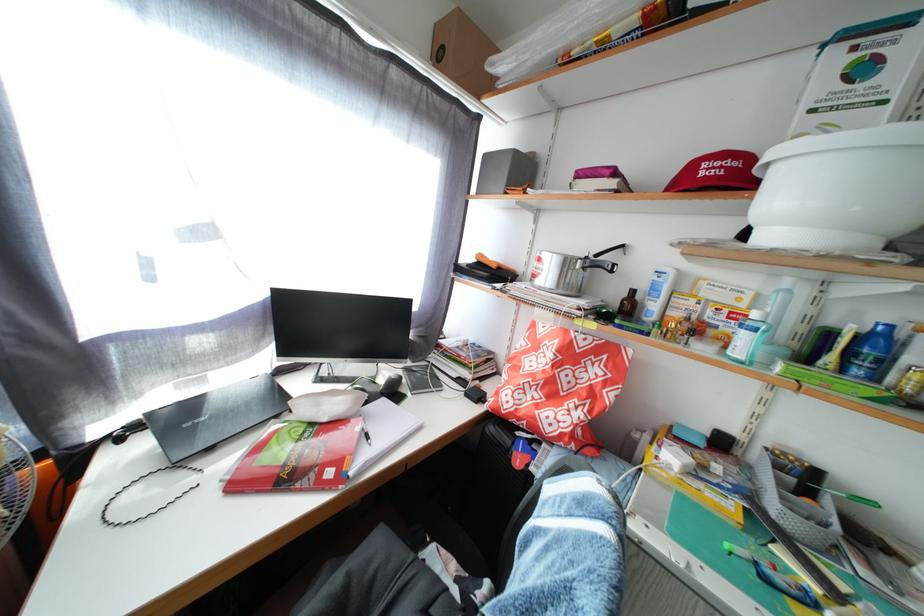
The width and height of the screenshot is (924, 616). What do you see at coordinates (492, 262) in the screenshot?
I see `the orange tool handle` at bounding box center [492, 262].